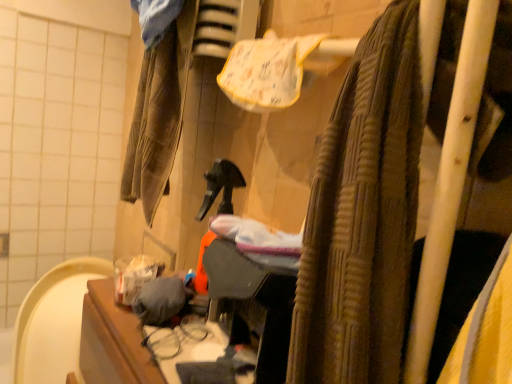
Question: Would you say brown textured towel at upper right contains brown corduroy pants at left, the first clothing positioned from the back?

Choices:
 (A) yes
 (B) no

Answer: (B)

Question: Does brown textured towel at upper right have a lesser width compared to brown corduroy pants at left, the first clothing in the top-to-bottom sequence?

Choices:
 (A) no
 (B) yes

Answer: (A)

Question: From a real-world perspective, is brown textured towel at upper right below brown corduroy pants at left, the 2th clothing when ordered from front to back?

Choices:
 (A) yes
 (B) no

Answer: (A)

Question: Considering the relative sizes of brown textured towel at upper right and brown corduroy pants at left, the first clothing positioned from the back, in the image provided, is brown textured towel at upper right shorter than brown corduroy pants at left, the first clothing positioned from the back,?

Choices:
 (A) yes
 (B) no

Answer: (B)

Question: Can you confirm if brown textured towel at upper right is bigger than brown corduroy pants at left, the 2th clothing when ordered from front to back?

Choices:
 (A) yes
 (B) no

Answer: (A)

Question: Looking at the image, does brown corduroy pants at left, the 2th clothing when ordered from front to back, seem bigger or smaller compared to gray fabric at center, the 2th clothing when ordered from top to bottom?

Choices:
 (A) small
 (B) big

Answer: (B)

Question: Does point (156, 145) appear closer or farther from the camera than point (172, 294)?

Choices:
 (A) closer
 (B) farther

Answer: (B)

Question: Considering the positions of brown corduroy pants at left, the second clothing when ordered from bottom to top, and gray fabric at center, the 2th clothing when ordered from top to bottom, in the image, is brown corduroy pants at left, the second clothing when ordered from bottom to top, wider or thinner than gray fabric at center, the 2th clothing when ordered from top to bottom,?

Choices:
 (A) thin
 (B) wide

Answer: (B)

Question: In the image, is brown corduroy pants at left, the second clothing when ordered from bottom to top, positioned in front of or behind gray fabric at center, the 2th clothing when ordered from top to bottom?

Choices:
 (A) front
 (B) behind

Answer: (B)

Question: Considering the positions of gray fabric at center, arranged as the 2th clothing when viewed from the back, and brown textured towel at upper right in the image, is gray fabric at center, arranged as the 2th clothing when viewed from the back, wider or thinner than brown textured towel at upper right?

Choices:
 (A) wide
 (B) thin

Answer: (B)

Question: From a real-world perspective, is gray fabric at center, the 2th clothing when ordered from top to bottom, physically located above or below brown textured towel at upper right?

Choices:
 (A) below
 (B) above

Answer: (A)

Question: Would you say gray fabric at center, the 2th clothing when ordered from top to bottom, is inside or outside brown textured towel at upper right?

Choices:
 (A) inside
 (B) outside

Answer: (B)

Question: Would you say gray fabric at center, the 2th clothing when ordered from top to bottom, is to the left or to the right of brown textured towel at upper right in the picture?

Choices:
 (A) left
 (B) right

Answer: (A)

Question: Considering the relative positions of gray fabric at center, which is counted as the first clothing, starting from the bottom, and brown corduroy pants at left, the second clothing when ordered from bottom to top, in the image provided, is gray fabric at center, which is counted as the first clothing, starting from the bottom, to the left or to the right of brown corduroy pants at left, the second clothing when ordered from bottom to top,?

Choices:
 (A) right
 (B) left

Answer: (A)

Question: From a real-world perspective, is gray fabric at center, arranged as the 2th clothing when viewed from the back, positioned above or below brown corduroy pants at left, the first clothing positioned from the back?

Choices:
 (A) above
 (B) below

Answer: (B)